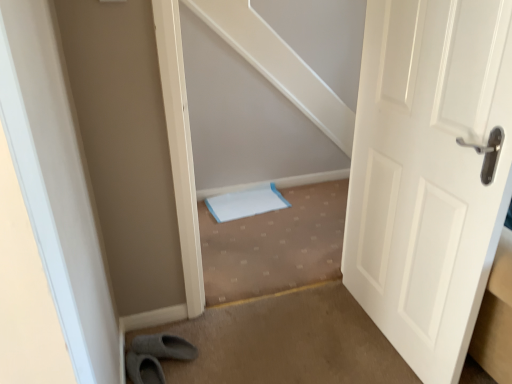
Question: Considering the relative sizes of carpeted stairwell at center and white matte door at right in the image provided, is carpeted stairwell at center shorter than white matte door at right?

Choices:
 (A) no
 (B) yes

Answer: (B)

Question: From a real-world perspective, is carpeted stairwell at center under white matte door at right?

Choices:
 (A) no
 (B) yes

Answer: (B)

Question: Is carpeted stairwell at center outside white matte door at right?

Choices:
 (A) yes
 (B) no

Answer: (A)

Question: Is carpeted stairwell at center positioned far away from white matte door at right?

Choices:
 (A) yes
 (B) no

Answer: (B)

Question: From a real-world perspective, is carpeted stairwell at center located higher than white matte door at right?

Choices:
 (A) yes
 (B) no

Answer: (B)

Question: Are carpeted stairwell at center and white matte door at right beside each other?

Choices:
 (A) yes
 (B) no

Answer: (B)

Question: From the image's perspective, would you say white matte door at right is positioned over carpeted stairwell at center?

Choices:
 (A) yes
 (B) no

Answer: (A)

Question: Can you confirm if white matte door at right is shorter than carpeted stairwell at center?

Choices:
 (A) no
 (B) yes

Answer: (A)

Question: Considering the relative sizes of white matte door at right and carpeted stairwell at center in the image provided, is white matte door at right wider than carpeted stairwell at center?

Choices:
 (A) yes
 (B) no

Answer: (B)

Question: Is white matte door at right positioned beyond the bounds of carpeted stairwell at center?

Choices:
 (A) yes
 (B) no

Answer: (A)

Question: Would you say white matte door at right is a long distance from carpeted stairwell at center?

Choices:
 (A) no
 (B) yes

Answer: (A)

Question: Is white matte door at right thinner than carpeted stairwell at center?

Choices:
 (A) no
 (B) yes

Answer: (B)

Question: In terms of width, does carpeted stairwell at center look wider or thinner when compared to white matte door at right?

Choices:
 (A) thin
 (B) wide

Answer: (B)